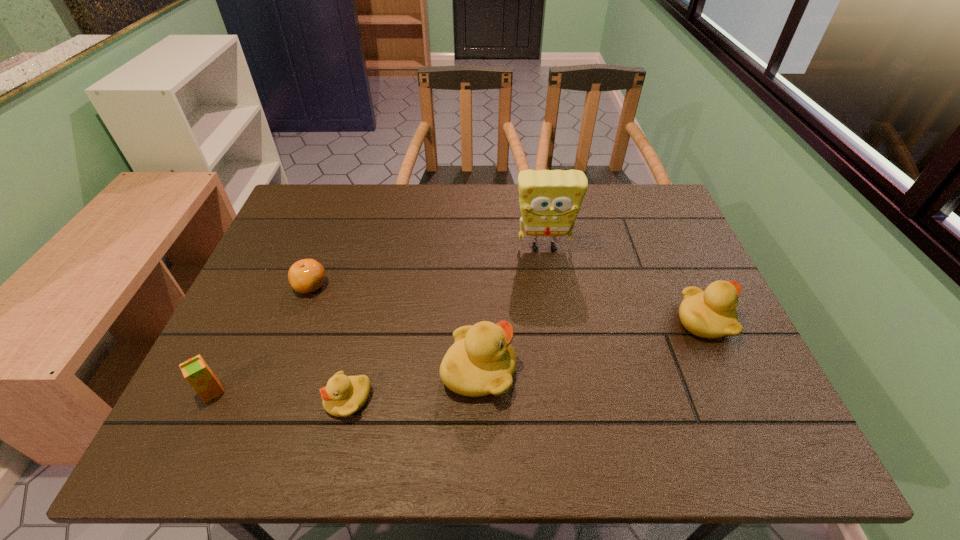
Identify the location of object situated at the near left corner. This screenshot has width=960, height=540. (198, 374).

Locate an element on the screen. The height and width of the screenshot is (540, 960). vacant region at the far edge of the desktop is located at coordinates (589, 194).

What are the coordinates of `vacant space at the left edge of the desktop` in the screenshot? It's located at (268, 291).

In the image, there is a desktop. Identify the location of vacant space at the right edge. (678, 240).

Find the location of a particular element. Image resolution: width=960 pixels, height=540 pixels. vacant space at the far left corner is located at coordinates (330, 194).

Where is `vacant space at the far right corner of the desktop`? vacant space at the far right corner of the desktop is located at coordinates (661, 202).

At what (x,y) coordinates should I click in order to perform the action: click on free spot between the second duckling from left to right and the rightmost duckling. Please return your answer as a coordinate pair (x, y). Looking at the image, I should click on point(591,346).

This screenshot has height=540, width=960. Identify the location of free space between the sponge and the rightmost object. (624, 284).

The width and height of the screenshot is (960, 540). Identify the location of free point between the sponge and the rightmost duckling. (624, 284).

In order to click on free space between the rightmost object and the leftmost duckling in this screenshot , I will do `click(526, 360)`.